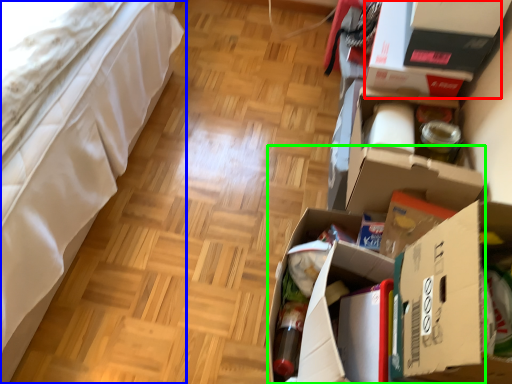
Question: Which object is the closest to the storage box (highlighted by a red box)? Choose among these: furniture (highlighted by a blue box) or cardboard box (highlighted by a green box).

Choices:
 (A) furniture
 (B) cardboard box

Answer: (B)